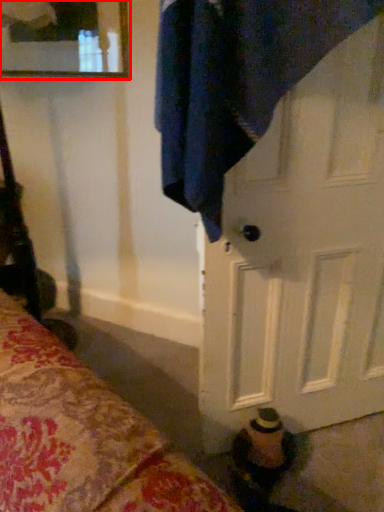
Question: From the image's perspective, where is mirror (annotated by the red box) located in relation to door in the image?

Choices:
 (A) below
 (B) above

Answer: (B)